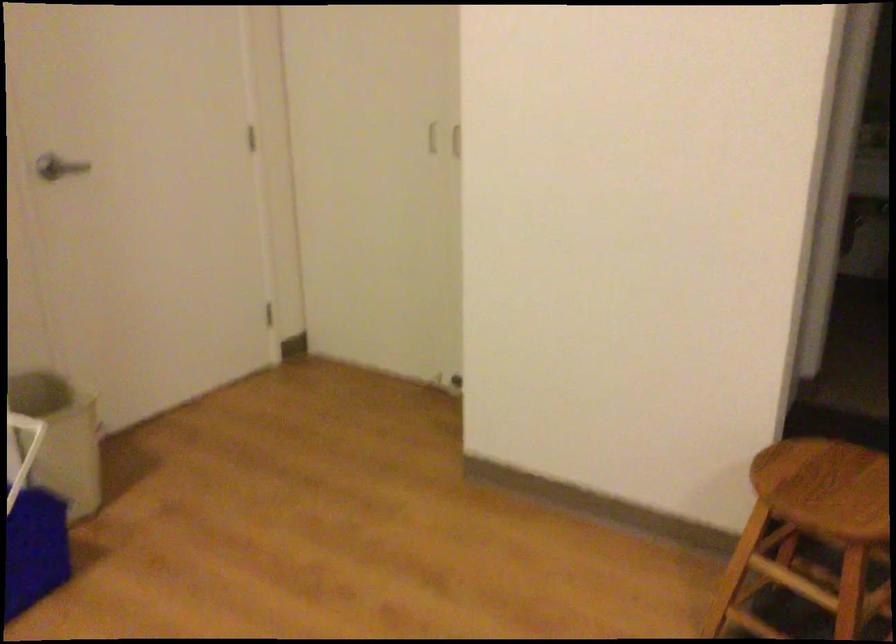
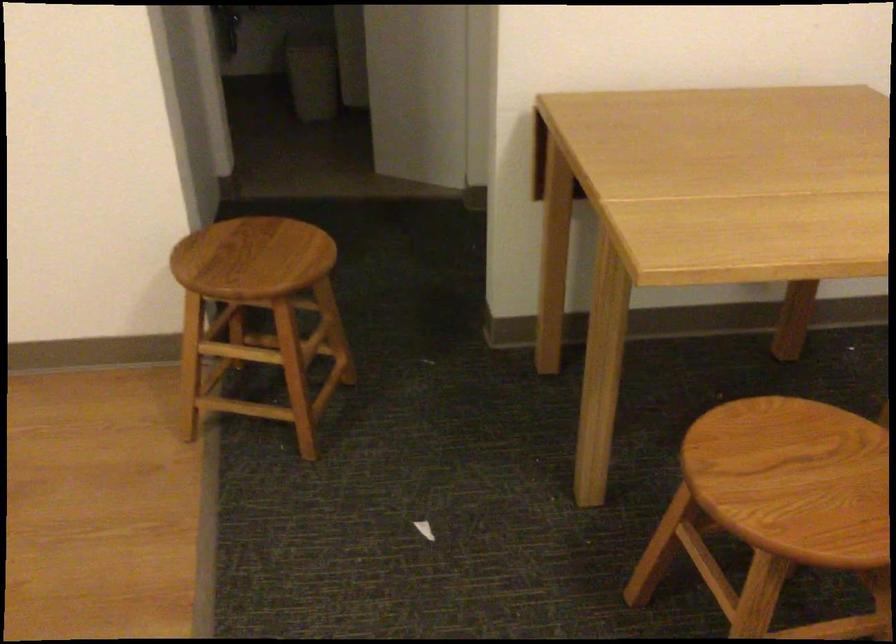
How did the camera likely rotate?

The rotation direction of the camera is right-down.